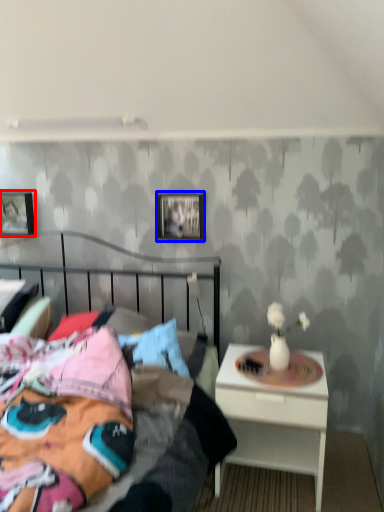
Question: Among these objects, which one is nearest to the camera, picture frame (highlighted by a red box) or picture frame (highlighted by a blue box)?

Choices:
 (A) picture frame
 (B) picture frame

Answer: (B)